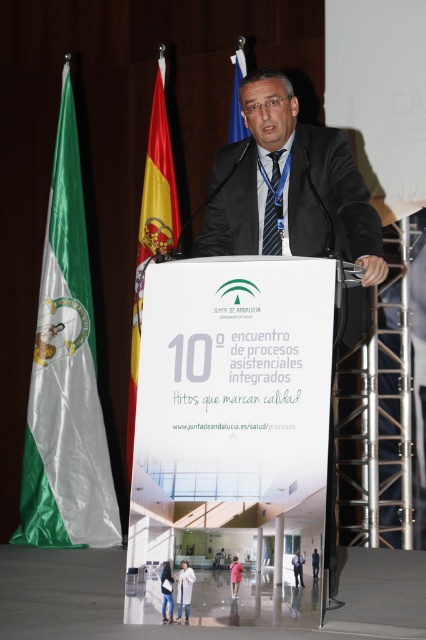
Question: Is blue fabric flag at upper center to the right of black suit at center from the viewer's perspective?

Choices:
 (A) no
 (B) yes

Answer: (A)

Question: Which object is the farthest from the blue fabric flag at upper center?

Choices:
 (A) matte black suit at center
 (B) red fabric flag at left

Answer: (A)

Question: Does dark blue textured suit at center have a greater width compared to blue fabric flag at upper center?

Choices:
 (A) no
 (B) yes

Answer: (B)

Question: Can you confirm if dark blue textured suit at center is positioned below matte black suit at center?

Choices:
 (A) no
 (B) yes

Answer: (A)

Question: Which object is farther from the camera taking this photo?

Choices:
 (A) blue fabric flag at upper center
 (B) black suit at center

Answer: (A)

Question: Which of these objects is positioned closest to the matte black suit at center?

Choices:
 (A) dark blue textured suit at center
 (B) blue striped tie at center

Answer: (A)